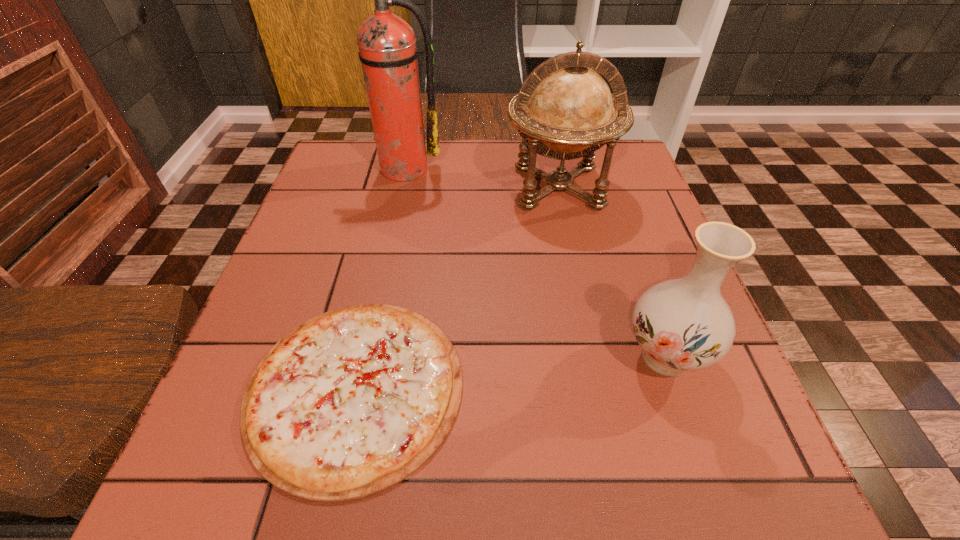
Find the location of a particular element. the tallest object is located at coordinates (387, 48).

In order to click on the third shortest object in this screenshot , I will do `click(564, 110)`.

Where is `vase`? The height and width of the screenshot is (540, 960). vase is located at coordinates (684, 324).

This screenshot has height=540, width=960. Find the location of `pizza`. pizza is located at coordinates (351, 402).

Image resolution: width=960 pixels, height=540 pixels. What are the coordinates of `free space located 0.050m at the nozzle of the fire extinguisher` in the screenshot? It's located at point(396,194).

Where is `vacant space situated on the front-facing side of the second tallest object`? This screenshot has height=540, width=960. vacant space situated on the front-facing side of the second tallest object is located at coordinates (575, 262).

I want to click on free location located 0.240m on the left of the second shortest object, so click(476, 356).

Locate an element on the screen. Image resolution: width=960 pixels, height=540 pixels. vacant space located on the back of the shortest object is located at coordinates (399, 188).

The height and width of the screenshot is (540, 960). I want to click on fire extinguisher that is positioned at the far edge, so click(387, 48).

Where is `globe that is positioned at the far edge`? The height and width of the screenshot is (540, 960). globe that is positioned at the far edge is located at coordinates (564, 110).